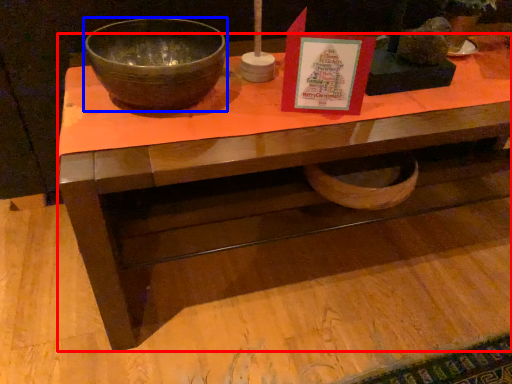
Question: Which point is further to the camera, desk (highlighted by a red box) or bowl (highlighted by a blue box)?

Choices:
 (A) desk
 (B) bowl

Answer: (B)